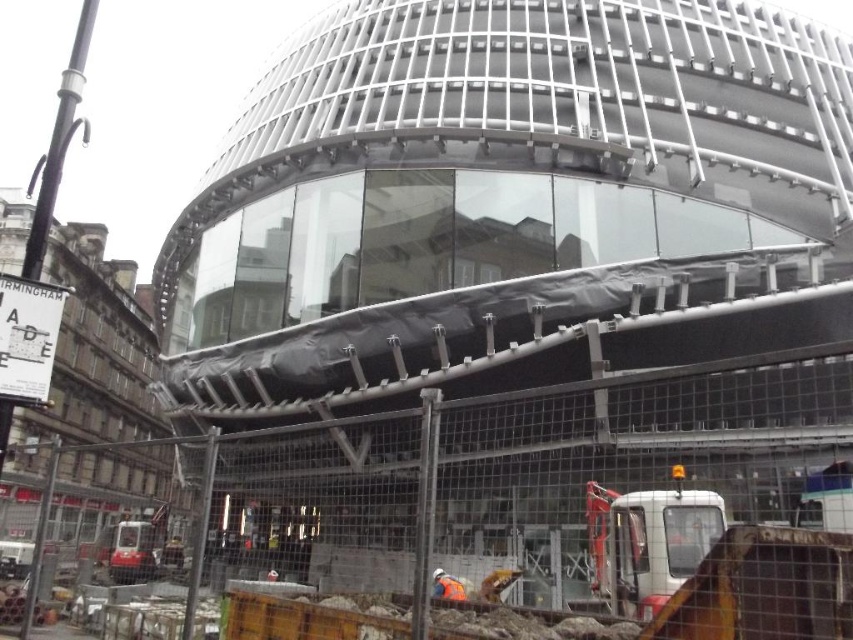
Question: Does metal mesh fence at center have a greater width compared to white plastic construction vehicle at lower right?

Choices:
 (A) no
 (B) yes

Answer: (B)

Question: Among these objects, which one is nearest to the camera?

Choices:
 (A) metal mesh fence at center
 (B) white plastic construction vehicle at lower right
 (C) metallic construction vehicle at lower left

Answer: (A)

Question: Which object appears farthest from the camera in this image?

Choices:
 (A) orange hard hat at center
 (B) metallic construction vehicle at lower left
 (C) metal mesh fence at center
 (D) white plastic construction vehicle at lower right

Answer: (B)

Question: Where is metal mesh fence at center located in relation to white plastic construction vehicle at lower right in the image?

Choices:
 (A) left
 (B) right

Answer: (A)

Question: Among these objects, which one is farthest from the camera?

Choices:
 (A) metallic construction vehicle at lower left
 (B) orange hard hat at center
 (C) metal mesh fence at center
 (D) white plastic construction vehicle at lower right

Answer: (A)

Question: Does metal mesh fence at center have a larger size compared to white plastic construction vehicle at lower right?

Choices:
 (A) no
 (B) yes

Answer: (B)